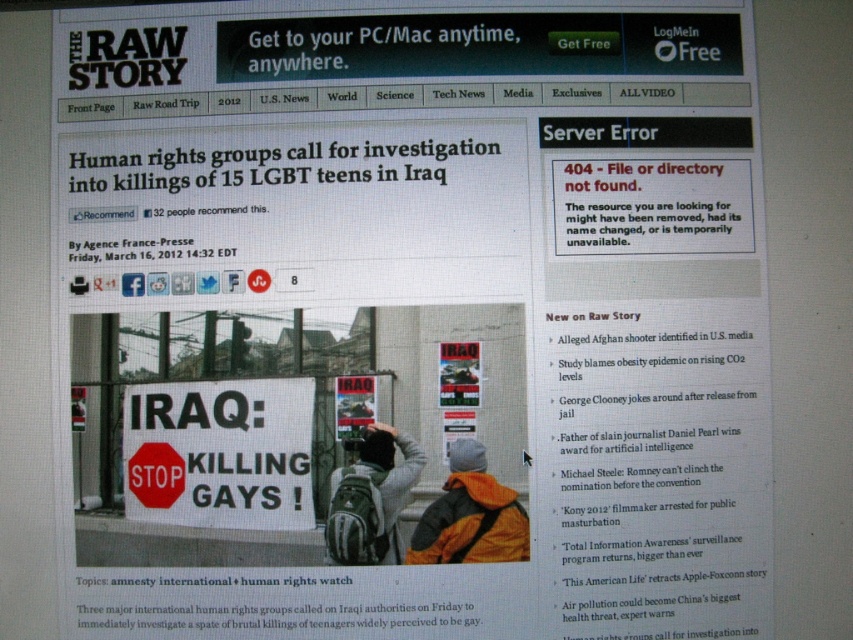
You are a delivery person who needs to place a gray backpack at center and a red matte stop sign at center into a storage locker. The locker has a height limit of 30 cm. Given their sizes, can both items fit vertically without exceeding the height limit?

The gray backpack at center has a greater height compared to the red matte stop sign at center. Since the locker has a height limit of 30 cm, if the gray backpack exceeds this limit, it cannot fit. However, the exact heights aren

Where is the orange fabric jacket at center located in the image?

The orange fabric jacket at center is located at point (469, 515).

You are a web developer trying to fix the Server Error on the right side of the screen. You see an orange fabric jacket at center and a red matte stop sign at center. Which object is nearer to you?

The orange fabric jacket at center is closer to the viewer than the red matte stop sign at center.